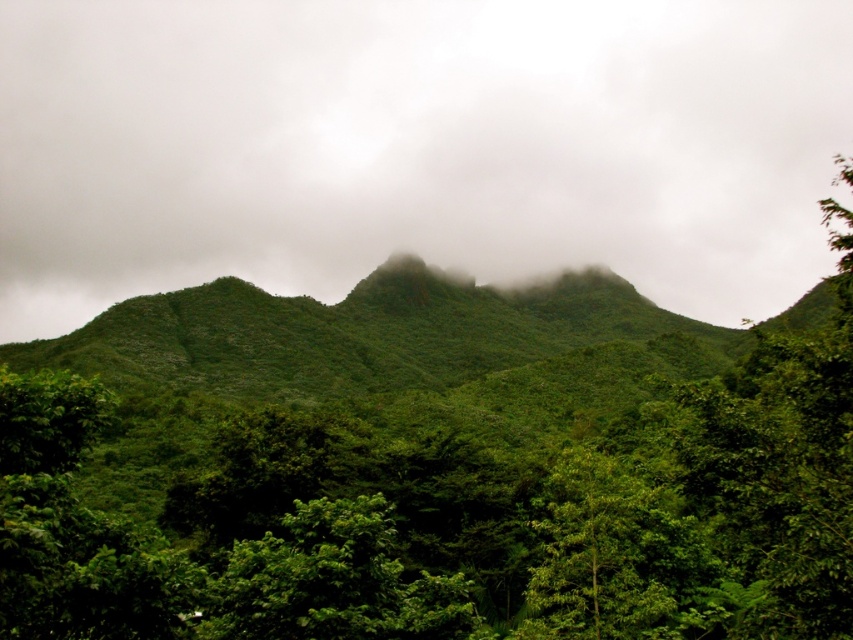
Question: Which point is farther to the camera?

Choices:
 (A) foggy misty mountain at upper center
 (B) green leafy tree at lower center

Answer: (A)

Question: Which of the following is the closest to the observer?

Choices:
 (A) (175, 179)
 (B) (651, 492)

Answer: (B)

Question: Which point appears farthest from the camera in this image?

Choices:
 (A) (587, 637)
 (B) (260, 152)

Answer: (B)

Question: Does foggy misty mountain at upper center appear on the left side of green leafy tree at lower center?

Choices:
 (A) yes
 (B) no

Answer: (B)

Question: Is foggy misty mountain at upper center to the right of green leafy tree at lower center from the viewer's perspective?

Choices:
 (A) no
 (B) yes

Answer: (B)

Question: Is foggy misty mountain at upper center further to the viewer compared to green leafy tree at lower center?

Choices:
 (A) no
 (B) yes

Answer: (B)